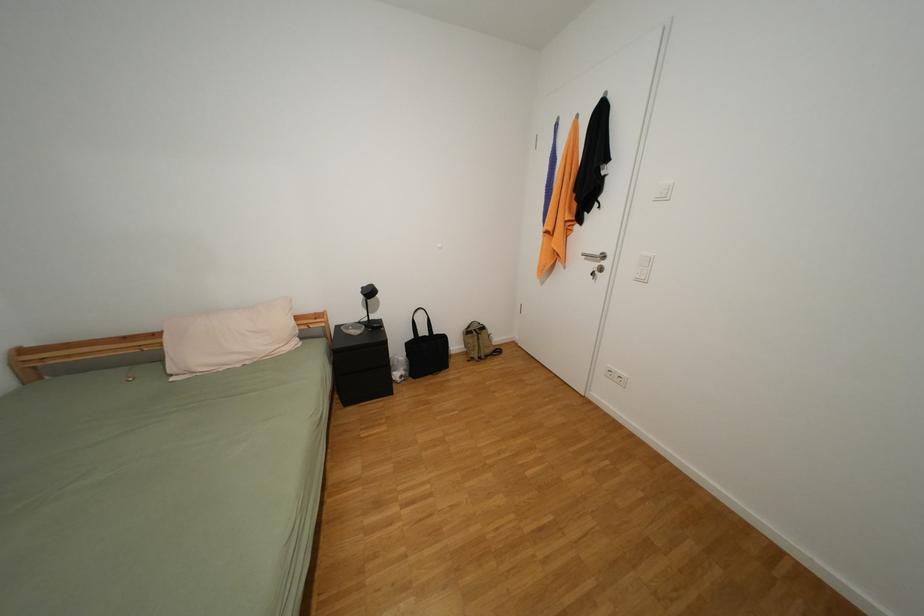
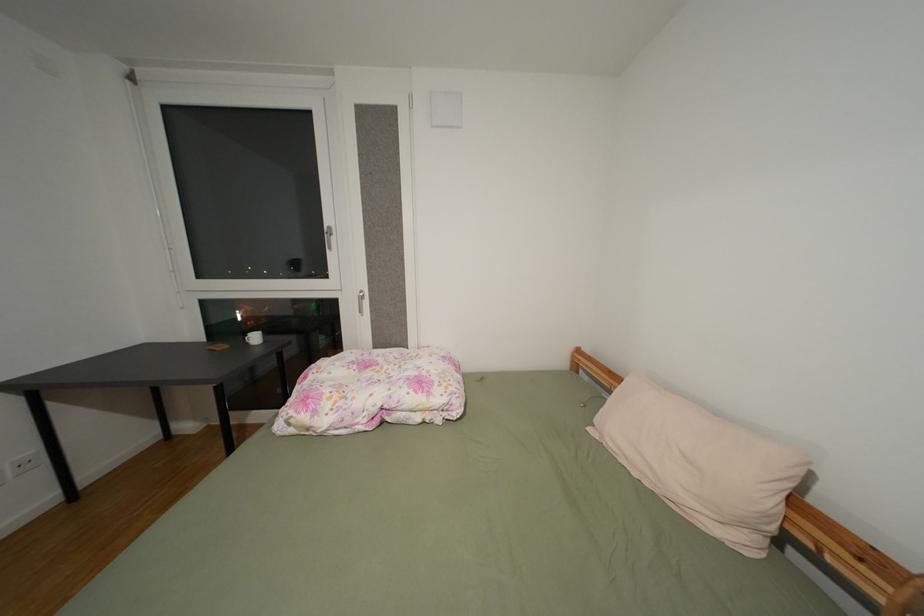
The images are taken continuously from a first-person perspective. In which direction is your viewpoint rotating?

The rotation direction of the camera is left-down.